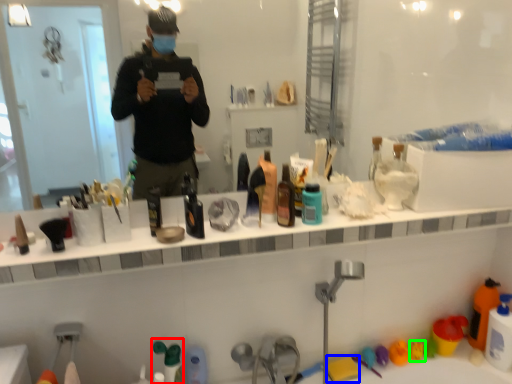
Question: Estimate the real-world distances between objects in this image. Which object is farther from toiletry (highlighted by a red box), toy (highlighted by a blue box) or toy (highlighted by a green box)?

Choices:
 (A) toy
 (B) toy

Answer: (B)